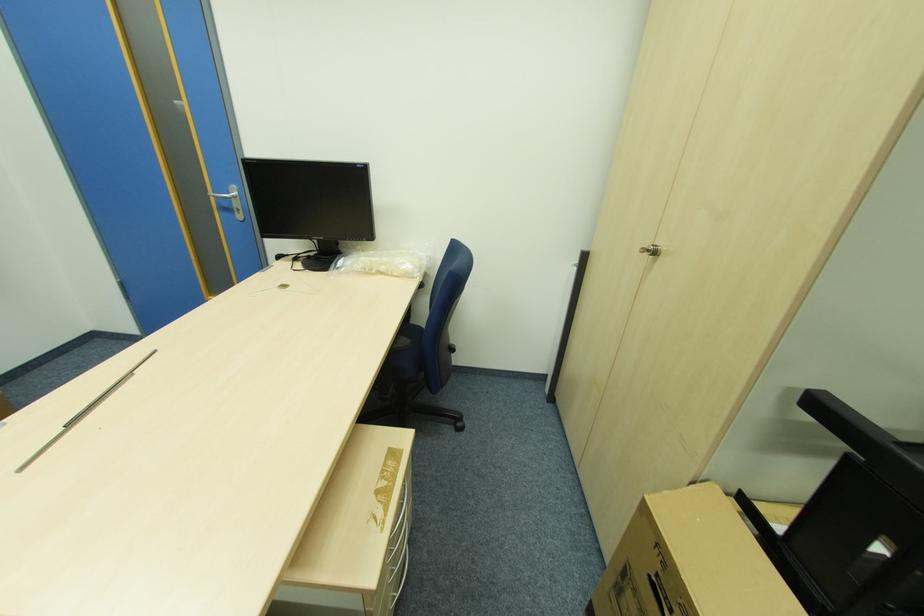
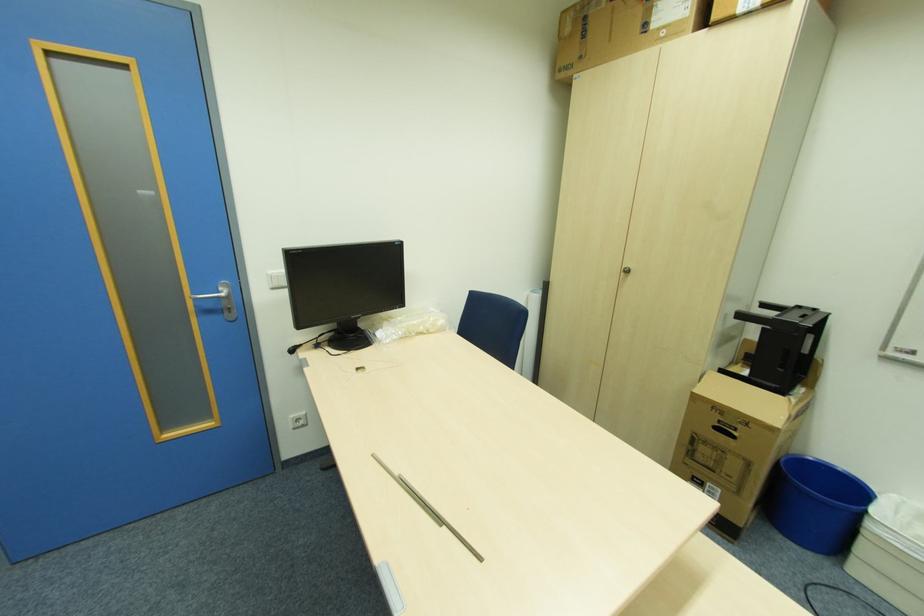
The point at (385,268) is marked in the first image. Where is the corresponding point in the second image?

(424, 329)